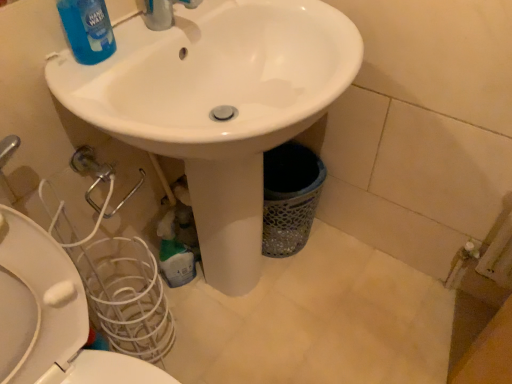
Question: Considering the positions of white glossy toilet at lower left and blue glossy liquid at upper left, the first cleaning product in the front-to-back sequence, in the image, is white glossy toilet at lower left taller or shorter than blue glossy liquid at upper left, the first cleaning product in the front-to-back sequence,?

Choices:
 (A) short
 (B) tall

Answer: (B)

Question: From the image's perspective, relative to blue glossy liquid at upper left, which ranks as the 1th cleaning product in top-to-bottom order, is white glossy toilet at lower left above or below?

Choices:
 (A) above
 (B) below

Answer: (B)

Question: Based on their relative distances, which object is nearer to the green plastic bottle at lower center, placed as the 2th cleaning product when sorted from top to bottom?

Choices:
 (A) white glossy toilet at lower left
 (B) blue glossy liquid at upper left, which ranks as the 1th cleaning product in top-to-bottom order
 (C) white glossy sink at center

Answer: (C)

Question: Which object is the farthest from the blue glossy liquid at upper left, the second cleaning product when ordered from back to front?

Choices:
 (A) white glossy toilet at lower left
 (B) white glossy sink at center
 (C) green plastic bottle at lower center, placed as the 2th cleaning product when sorted from top to bottom

Answer: (C)